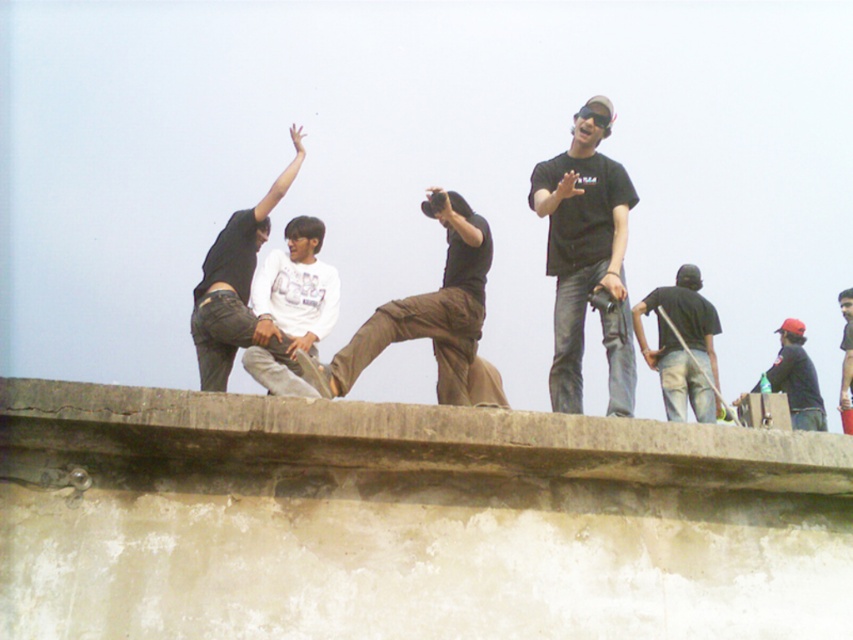
Question: Which object is positioned farthest from the white matte shirt at center?

Choices:
 (A) dark gray jeans at center
 (B) brown cotton pants at center
 (C) black matte shirt at upper center

Answer: (C)

Question: Which object appears farthest from the camera in this image?

Choices:
 (A) brown cotton pants at center
 (B) black matte shirt at upper center

Answer: (B)

Question: Can you confirm if black matte shirt at upper center is positioned to the left of dark gray jeans at center?

Choices:
 (A) yes
 (B) no

Answer: (B)

Question: Among these points, which one is farthest from the camera?

Choices:
 (A) (845, 378)
 (B) (344, 365)

Answer: (A)

Question: Is brown cotton pants at center positioned at the back of dark gray jeans at right?

Choices:
 (A) no
 (B) yes

Answer: (A)

Question: Does black matte shirt at upper center lie behind dark gray jeans at right?

Choices:
 (A) no
 (B) yes

Answer: (A)